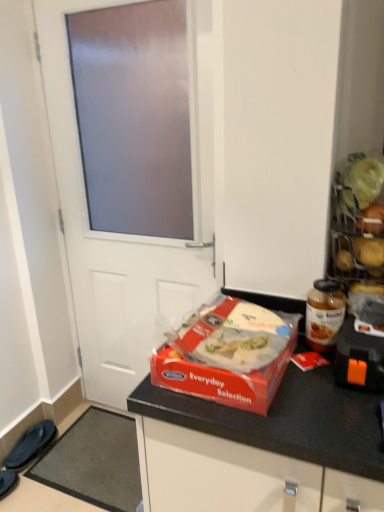
Question: Considering the relative sizes of red matte plastic box of food at center and black fabric slipper at lower left, which is the 2th footwear from front to back, in the image provided, is red matte plastic box of food at center wider than black fabric slipper at lower left, which is the 2th footwear from front to back,?

Choices:
 (A) yes
 (B) no

Answer: (A)

Question: Is red matte plastic box of food at center located outside black fabric slipper at lower left, which is the 2th footwear from front to back?

Choices:
 (A) no
 (B) yes

Answer: (B)

Question: Is black fabric slipper at lower left, which is the 2th footwear from front to back, surrounded by red matte plastic box of food at center?

Choices:
 (A) yes
 (B) no

Answer: (B)

Question: Is red matte plastic box of food at center positioned behind black fabric slipper at lower left, which is the 2th footwear from front to back?

Choices:
 (A) yes
 (B) no

Answer: (B)

Question: Is red matte plastic box of food at center thinner than black fabric slipper at lower left, which is the 2th footwear from front to back?

Choices:
 (A) no
 (B) yes

Answer: (A)

Question: Which is correct: red matte plastic box of food at center is inside dark blue fabric slippers at lower left, which is counted as the first footwear, starting from the front, or outside of it?

Choices:
 (A) inside
 (B) outside

Answer: (B)

Question: Considering the positions of red matte plastic box of food at center and dark blue fabric slippers at lower left, the second footwear viewed from the back, in the image, is red matte plastic box of food at center wider or thinner than dark blue fabric slippers at lower left, the second footwear viewed from the back,?

Choices:
 (A) thin
 (B) wide

Answer: (B)

Question: Considering the positions of red matte plastic box of food at center and dark blue fabric slippers at lower left, which is counted as the first footwear, starting from the front, in the image, is red matte plastic box of food at center taller or shorter than dark blue fabric slippers at lower left, which is counted as the first footwear, starting from the front,?

Choices:
 (A) short
 (B) tall

Answer: (A)

Question: Would you say red matte plastic box of food at center is to the left or to the right of dark blue fabric slippers at lower left, which is counted as the first footwear, starting from the front, in the picture?

Choices:
 (A) left
 (B) right

Answer: (B)

Question: Looking at their shapes, would you say red matte plastic box of food at center is wider or thinner than black fabric slipper at lower left, the first footwear when ordered from back to front?

Choices:
 (A) thin
 (B) wide

Answer: (B)

Question: Is red matte plastic box of food at center to the left or to the right of black fabric slipper at lower left, which is the 2th footwear from front to back, in the image?

Choices:
 (A) right
 (B) left

Answer: (A)

Question: From the image's perspective, is red matte plastic box of food at center above or below black fabric slipper at lower left, the first footwear when ordered from back to front?

Choices:
 (A) above
 (B) below

Answer: (A)

Question: Is point (235, 356) positioned closer to the camera than point (9, 465)?

Choices:
 (A) farther
 (B) closer

Answer: (B)

Question: Is white matte door at center wider or thinner than translucent glass jar at right?

Choices:
 (A) thin
 (B) wide

Answer: (A)

Question: Does point (203, 273) appear closer or farther from the camera than point (319, 342)?

Choices:
 (A) closer
 (B) farther

Answer: (B)